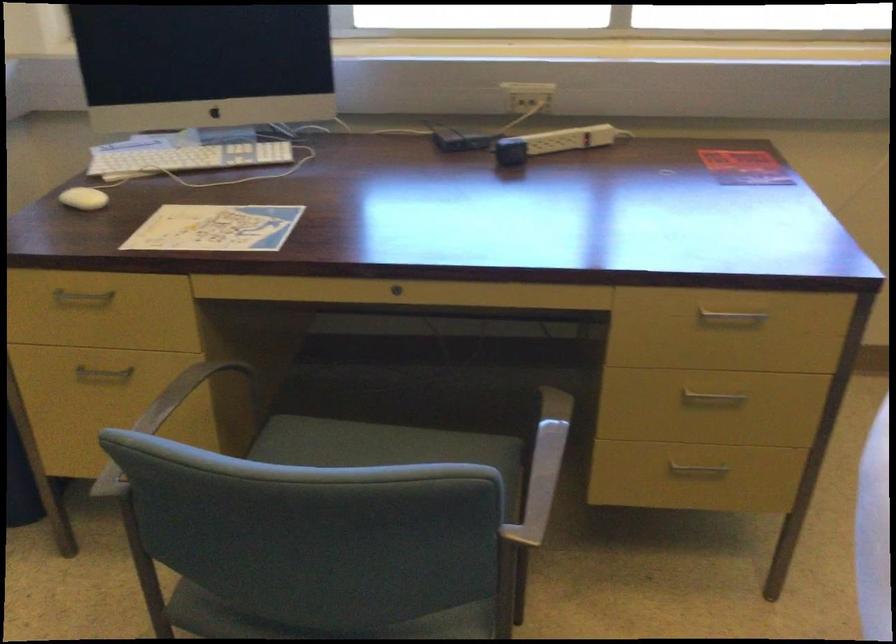
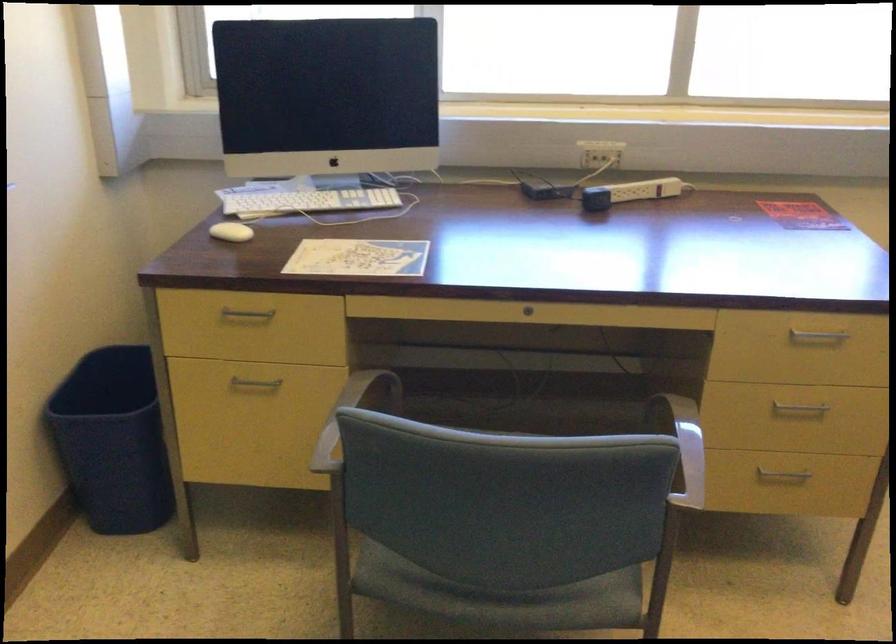
Where in the second image is the point corresponding to (117,440) from the first image?

(350, 415)